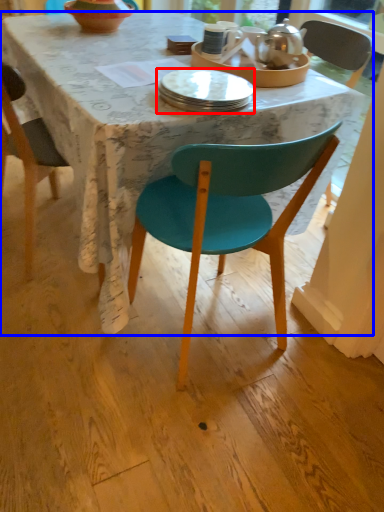
Question: Which point is closer to the camera, plate (highlighted by a red box) or desk (highlighted by a blue box)?

Choices:
 (A) plate
 (B) desk

Answer: (B)